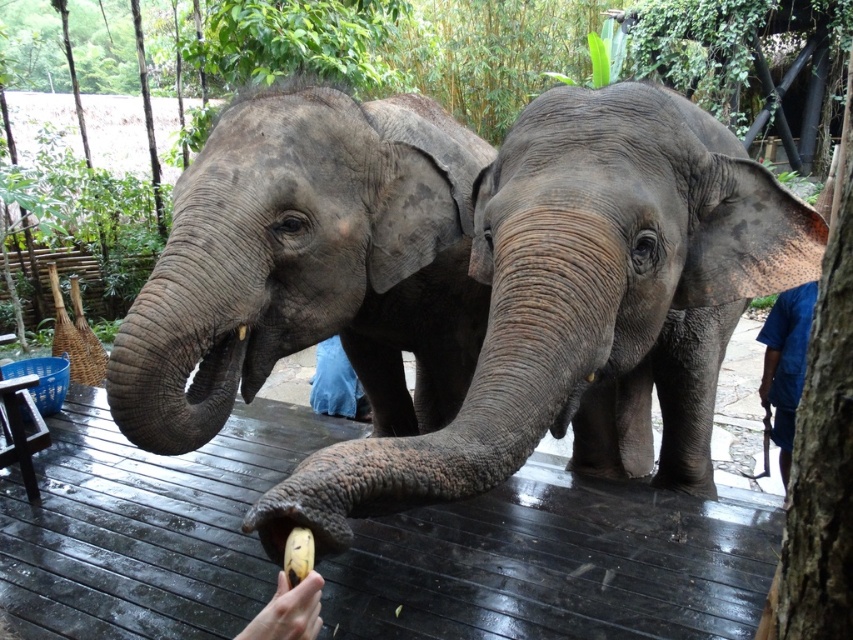
Can you confirm if dark brown wooden deck at center is bigger than blue fabric shirt at right?

Yes.

Between point (426, 586) and point (805, 356), which one is positioned behind?

Point (805, 356)

Is point (238, 572) positioned before point (775, 404)?

Yes, point (238, 572) is closer to viewer.

Find the location of a particular element. The width and height of the screenshot is (853, 640). dark brown wooden deck at center is located at coordinates (556, 564).

Is blue denim pants at center thinner than yellow matte banana at lower center?

In fact, blue denim pants at center might be wider than yellow matte banana at lower center.

Can you confirm if blue denim pants at center is positioned to the right of yellow matte banana at lower center?

In fact, blue denim pants at center is to the left of yellow matte banana at lower center.

Is point (320, 381) positioned before point (294, 576)?

That is False.

Locate an element on the screen. The width and height of the screenshot is (853, 640). blue denim pants at center is located at coordinates (335, 384).

Describe the element at coordinates (581, 300) in the screenshot. This screenshot has height=640, width=853. I see `gray rough elephant at center` at that location.

This screenshot has width=853, height=640. Describe the element at coordinates (581, 300) in the screenshot. I see `gray rough elephant at center` at that location.

At what (x,y) coordinates should I click in order to perform the action: click on gray rough elephant at center. Please return your answer as a coordinate pair (x, y). This screenshot has width=853, height=640. Looking at the image, I should click on (581, 300).